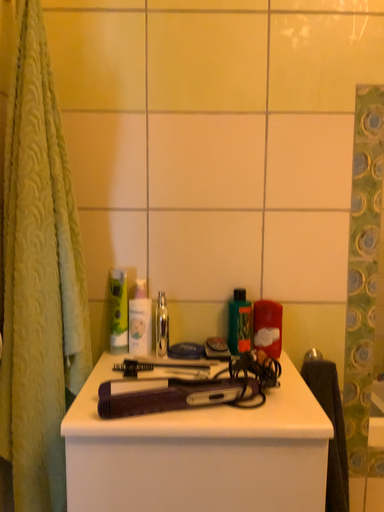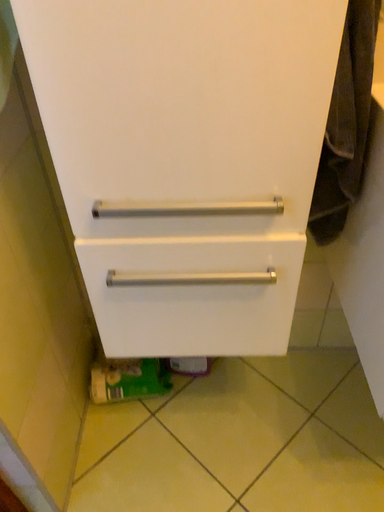
Question: Which way did the camera rotate in the video?

Choices:
 (A) rotated upward
 (B) rotated downward

Answer: (B)